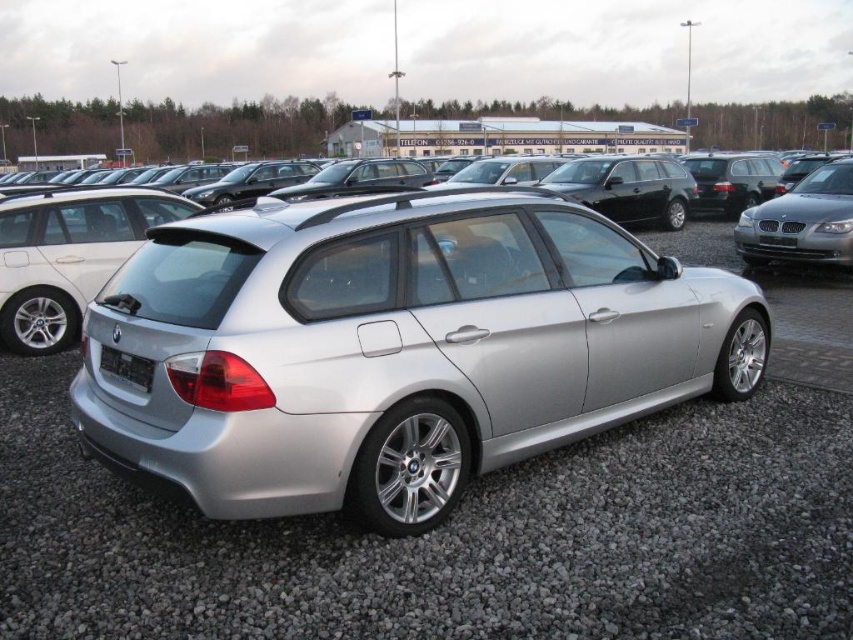
You are a car salesperson who needs to fit a 6.5 feet tall sculpture into the trunk of either the silver metallic sedan at center or the satin black sedan at center. Which car should you recommend based on trunk height?

The silver metallic sedan at center has a lesser height compared to the satin black sedan at center. Therefore, the satin black sedan at center would be the better choice as its trunk likely offers more vertical space to accommodate the 6.5 feet tall sculpture.

Consider the image. You are a photographer trying to capture the satin silver sedan at center and the black plastic license plate at rear in a single shot. Which object should you adjust your camera angle to focus on first to ensure both are in frame?

The satin silver sedan at center is positioned on the left side of the black plastic license plate at rear, so you should focus on the satin silver sedan at center first to ensure both are included in the frame.

You are a car salesman who wants to direct a customer to the satin silver car at right. Which direction should the customer walk from the silver gravel at center to reach it?

The customer should walk upwards from the silver gravel at center to reach the satin silver car at right since the silver gravel at center is below the satin silver car at right.